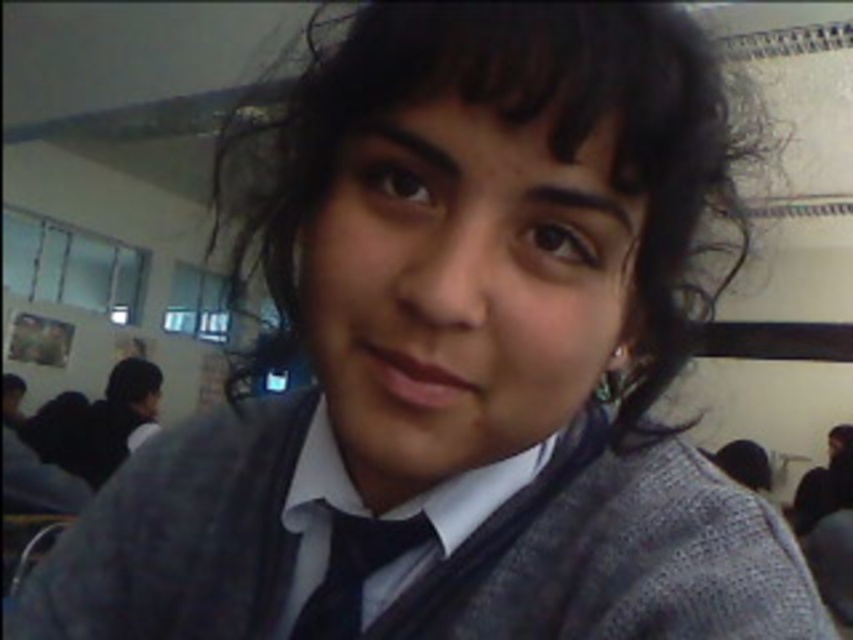
You are a photographer setting up for a group photo in the classroom. You notice the matte gray sweater at center and the dark brown silky hair at center. Which object should you adjust your camera focus to first if you want to capture both clearly?

The matte gray sweater at center is to the left of dark brown silky hair at center, so you should focus on the dark brown silky hair at center first since it is closer to the camera.